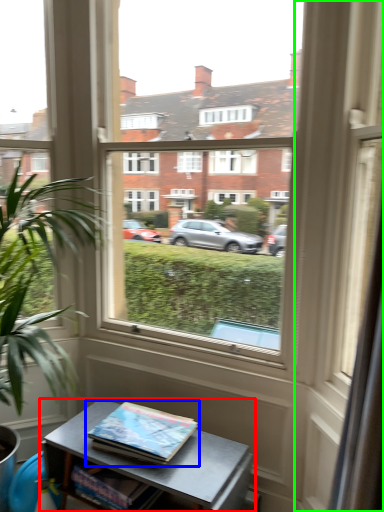
Question: Which object is positioned closest to table (highlighted by a red box)? Select from book (highlighted by a blue box) and glass door (highlighted by a green box).

Choices:
 (A) book
 (B) glass door

Answer: (A)